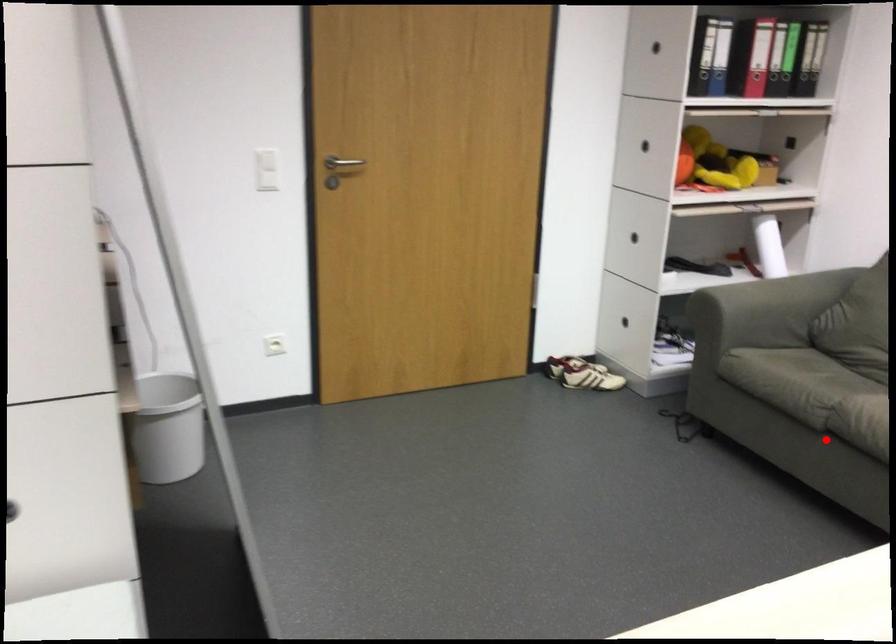
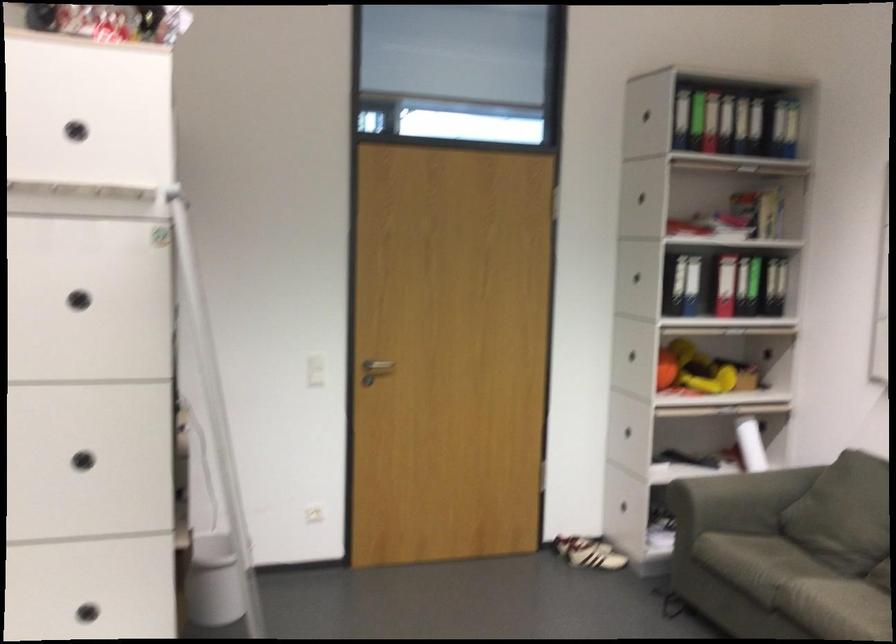
Question: I am providing you with two images of the same scene from different viewpoints. In image1, a red point is highlighted. Considering the same 3D point in image2, which of the following is correct?

Choices:
 (A) It is closer
 (B) It is farther

Answer: (B)